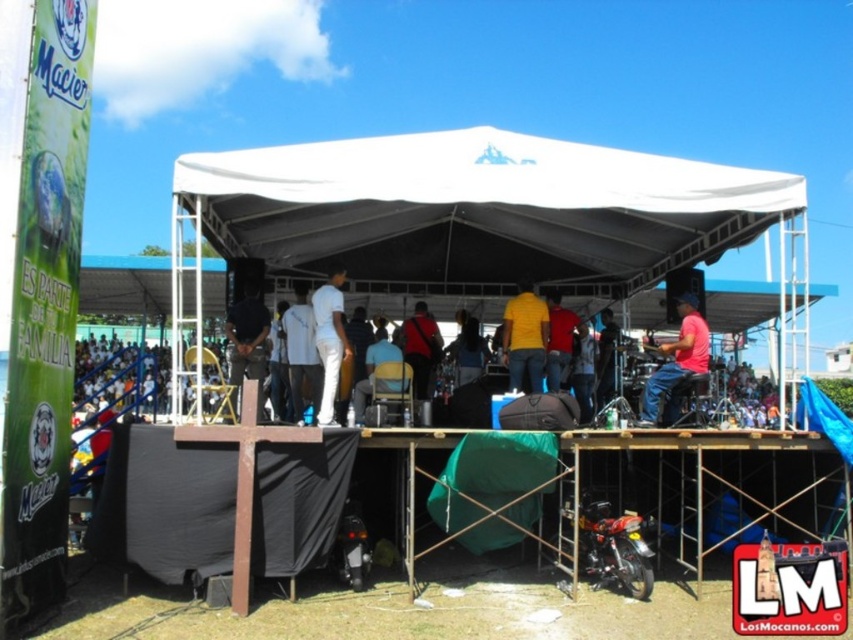
You are an event photographer at the outdoor event under the large white canopy tent. You need to take a photo of the two performers wearing the matte black shirt at center and dark blue shirt at center. Which performer should you focus on first if you want to capture them from left to right in the frame?

The matte black shirt at center is to the left of dark blue shirt at center, so you should focus on the matte black shirt at center first to capture them from left to right in the frame.

You are a stagehand preparing to move a 1.5 meter wide equipment cart from the left side of the stage towards the center. There are two objects in your path, the dark blue fabric at center and the white matte pants at center. Based on their distance apart, can you safely navigate the cart between them without hitting either?

The dark blue fabric at center and white matte pants at center are 2.07 meters apart. Since the equipment cart is 1.5 meters wide, there is enough space between them to safely navigate the cart through without collision.

You are a photographer standing behind the audience. You need to capture a photo of both the matte black shirt at center and the dark blue shirt at center in the same frame. The camera you are using has a maximum focus range of 10 feet. Can you fit both subjects within the focus range?

The distance between the matte black shirt at center and the dark blue shirt at center is 9.98 feet, which is just under the camera maximum focus range of 10 feet. Therefore, both subjects can be captured within the focus range.